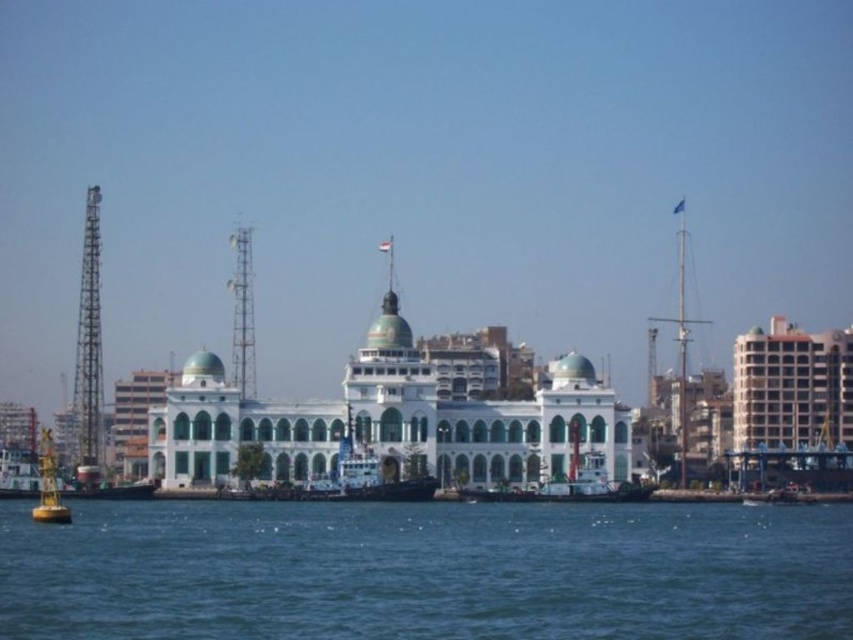
You are a dock worker who needs to secure both the white glossy boat at center and the white matte tugboat at center to the pier. Given their sizes, which boat will require more space to properly secure?

The white glossy boat at center requires more space to properly secure since it has a larger size compared to the white matte tugboat at center.

You are a crane operator tasked with lifting the white glossy boat at center and the white matte tugboat at center from the water. Which one will require a taller crane to lift?

The white glossy boat at center is taller than the white matte tugboat at center, so it will require a taller crane to lift.

You are standing at a location 154.25 meters away from the point marked at coordinates point [155,529]. If you want to move closer to this point, which direction should you move in relation to the waterfront scene?

To move closer to the point marked at coordinates point [155,529], you should move towards the waterfront scene since the camera is currently 154.25 meters away from that point.